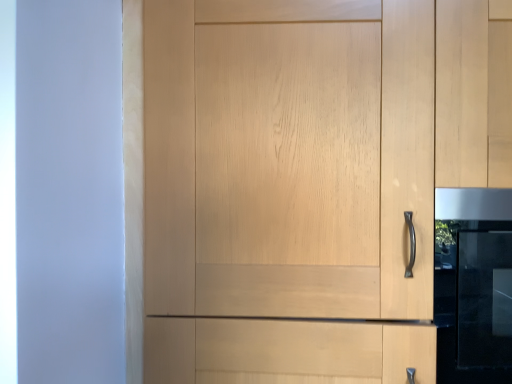
Image resolution: width=512 pixels, height=384 pixels. What are the coordinates of `satin black oven at right` in the screenshot? It's located at (473, 285).

Describe the element at coordinates (473, 285) in the screenshot. I see `satin black oven at right` at that location.

This screenshot has height=384, width=512. What do you see at coordinates (302, 181) in the screenshot?
I see `light wood cupboard at center` at bounding box center [302, 181].

You are a GUI agent. You are given a task and a screenshot of the screen. Output one action in this format:
    pyautogui.click(x=<x>, y=<y>)
    Task: Click on the light wood cupboard at center
    
    Given the screenshot: What is the action you would take?
    pyautogui.click(x=302, y=181)

The image size is (512, 384). I want to click on satin black oven at right, so click(473, 285).

Which is more to the right, satin black oven at right or light wood cupboard at center?

From the viewer's perspective, satin black oven at right appears more on the right side.

Is the position of satin black oven at right more distant than that of light wood cupboard at center?

Yes.

Considering the positions of points (437, 215) and (150, 343), is point (437, 215) closer to camera compared to point (150, 343)?

That is True.

From the image's perspective, is satin black oven at right over light wood cupboard at center?

Incorrect, from the image's perspective, satin black oven at right is lower than light wood cupboard at center.

From a real-world perspective, does satin black oven at right stand above light wood cupboard at center?

No, from a real-world perspective, satin black oven at right is not above light wood cupboard at center.

In terms of width, does satin black oven at right look wider or thinner when compared to light wood cupboard at center?

Clearly, satin black oven at right has less width compared to light wood cupboard at center.

Considering the sizes of satin black oven at right and light wood cupboard at center in the image, is satin black oven at right taller or shorter than light wood cupboard at center?

Clearly, satin black oven at right is shorter compared to light wood cupboard at center.

Who is bigger, satin black oven at right or light wood cupboard at center?

→ light wood cupboard at center.

Is light wood cupboard at center located within satin black oven at right?

No, light wood cupboard at center is not a part of satin black oven at right.

Is satin black oven at right not close to light wood cupboard at center?

No, satin black oven at right is not far away from light wood cupboard at center.

Is satin black oven at right looking in the opposite direction of light wood cupboard at center?

Correct, satin black oven at right is looking away from light wood cupboard at center.

What's the angular difference between satin black oven at right and light wood cupboard at center's facing directions?

7.04e-05 degrees.

This screenshot has height=384, width=512. I want to click on cupboard positioned vertically above the satin black oven at right (from a real-world perspective), so click(x=302, y=181).

Considering the relative positions of light wood cupboard at center and satin black oven at right in the image provided, is light wood cupboard at center to the right of satin black oven at right from the viewer's perspective?

No, light wood cupboard at center is not to the right of satin black oven at right.

Considering the positions of objects light wood cupboard at center and satin black oven at right in the image provided, who is in front, light wood cupboard at center or satin black oven at right?

light wood cupboard at center is in front.

Which is in front, point (336, 56) or point (502, 254)?

The point (336, 56) is in front.

From the image's perspective, which object appears higher, light wood cupboard at center or satin black oven at right?

light wood cupboard at center.

From a real-world perspective, which is physically below, light wood cupboard at center or satin black oven at right?

satin black oven at right.

Is light wood cupboard at center wider than satin black oven at right?

Indeed, light wood cupboard at center has a greater width compared to satin black oven at right.

Does light wood cupboard at center have a greater height compared to satin black oven at right?

Yes.

In the scene shown: Considering the sizes of objects light wood cupboard at center and satin black oven at right in the image provided, who is smaller, light wood cupboard at center or satin black oven at right?

With smaller size is satin black oven at right.

Is light wood cupboard at center surrounding satin black oven at right?

Result: Yes, light wood cupboard at center is surrounding satin black oven at right.

Are light wood cupboard at center and satin black oven at right making contact?

They are not placed beside each other.

Is light wood cupboard at center turned away from satin black oven at right?

Yes, light wood cupboard at center's orientation is away from satin black oven at right.

Identify the location of cupboard that appears above the satin black oven at right (from the image's perspective). (302, 181).

Locate an element on the screen. The image size is (512, 384). cupboard above the satin black oven at right (from the image's perspective) is located at coordinates (302, 181).

Where is `oven below the light wood cupboard at center (from the image's perspective)`? This screenshot has height=384, width=512. oven below the light wood cupboard at center (from the image's perspective) is located at coordinates (473, 285).